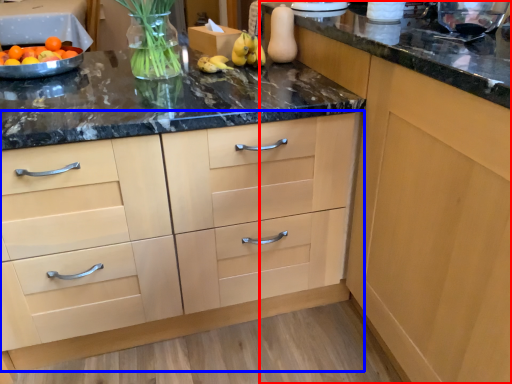
Question: Which object is closer to the camera taking this photo, cabinetry (highlighted by a red box) or cabinetry (highlighted by a blue box)?

Choices:
 (A) cabinetry
 (B) cabinetry

Answer: (A)